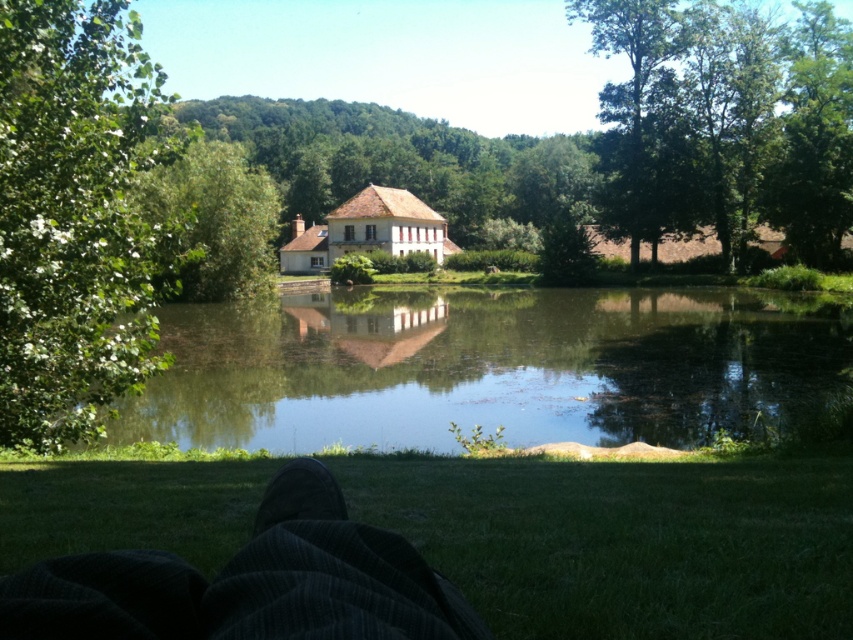
Question: Which point appears closest to the camera in this image?

Choices:
 (A) (611, 202)
 (B) (590, 408)

Answer: (B)

Question: Does green leafy tree at left lie in front of dark corduroy pants at lower center?

Choices:
 (A) yes
 (B) no

Answer: (B)

Question: Which point is closer to the camera?

Choices:
 (A) (268, 499)
 (B) (51, 92)
 (C) (212, 257)
 (D) (848, 164)

Answer: (A)

Question: Is dark corduroy pants at lower center bigger than black fabric foot at lower center?

Choices:
 (A) yes
 (B) no

Answer: (A)

Question: Which point is farther from the camera taking this photo?

Choices:
 (A) (225, 154)
 (B) (171, 419)
 (C) (329, 483)

Answer: (A)

Question: Is clear water at center to the left of black fabric foot at lower center from the viewer's perspective?

Choices:
 (A) no
 (B) yes

Answer: (A)